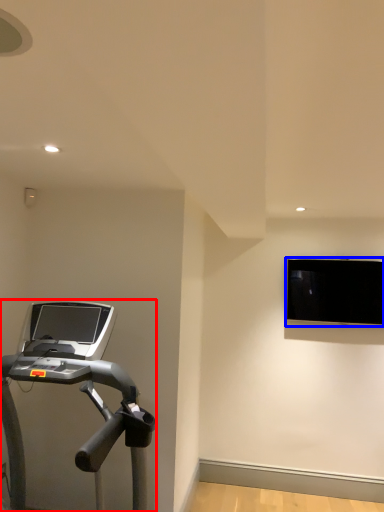
Question: Which of the following is the closest to the observer, treadmill (highlighted by a red box) or computer monitor (highlighted by a blue box)?

Choices:
 (A) treadmill
 (B) computer monitor

Answer: (A)